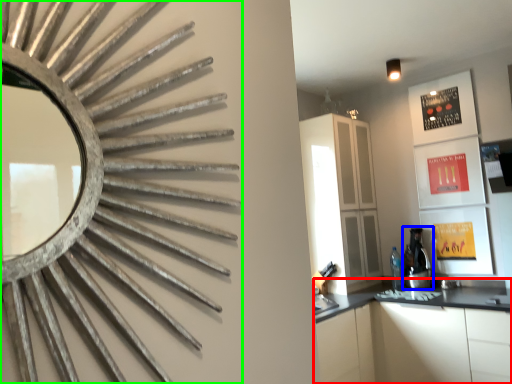
Question: Considering the real-world distances, which object is closest to cabinetry (highlighted by a red box)? coffee machine (highlighted by a blue box) or mirror (highlighted by a green box).

Choices:
 (A) coffee machine
 (B) mirror

Answer: (A)